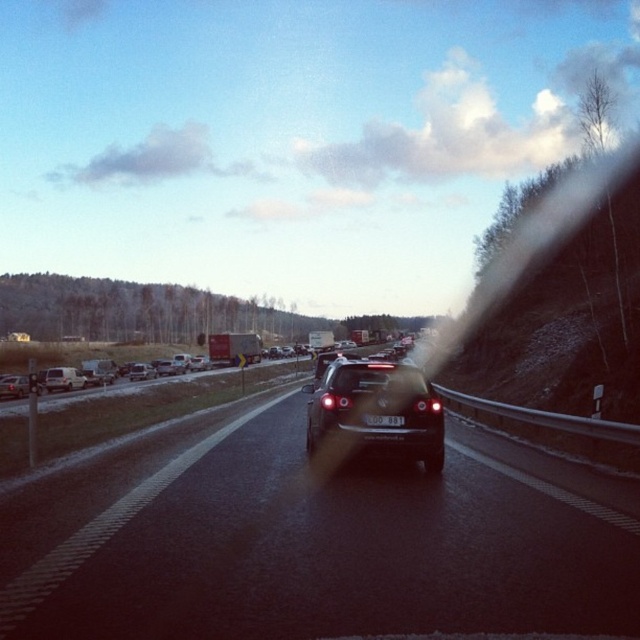
Question: Is the position of metallic silver sedan at center-left less distant than that of silver metallic sedan at left?

Choices:
 (A) no
 (B) yes

Answer: (A)

Question: Among these points, which one is farthest from the camera?

Choices:
 (A) (147, 378)
 (B) (326, 396)

Answer: (A)

Question: Estimate the real-world distances between objects in this image. Which object is farther from the matte black car at left?

Choices:
 (A) black glossy car at center
 (B) silver metallic van at left
 (C) silver metallic sedan at left
 (D) metallic silver sedan at center-left

Answer: (D)

Question: Can you confirm if black glossy car at center is positioned to the left of metallic silver sedan at center-left?

Choices:
 (A) no
 (B) yes

Answer: (A)

Question: Which object is positioned farthest from the matte black car at left?

Choices:
 (A) satin black car at center
 (B) black plastic license plate at center
 (C) silver metallic sedan at left

Answer: (C)

Question: Can you confirm if satin black car at center is wider than silver metallic van at left?

Choices:
 (A) no
 (B) yes

Answer: (B)